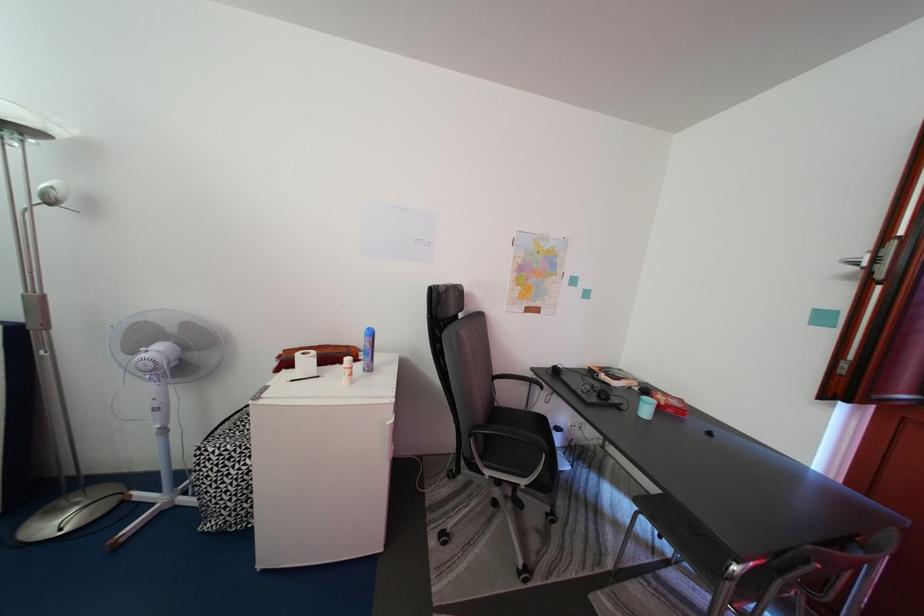
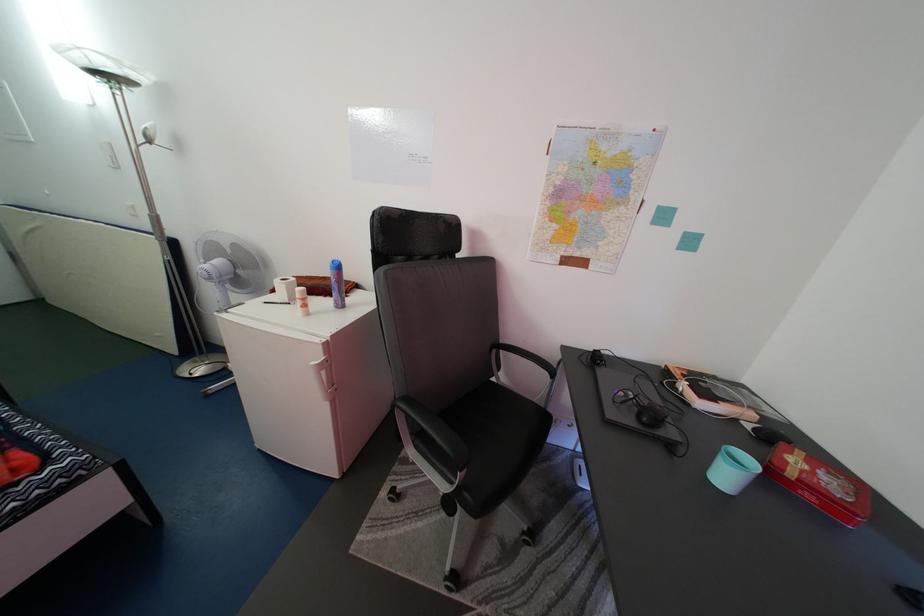
Where in the second image is the point corresponding to pixel 357 379 from the first image?

(308, 310)